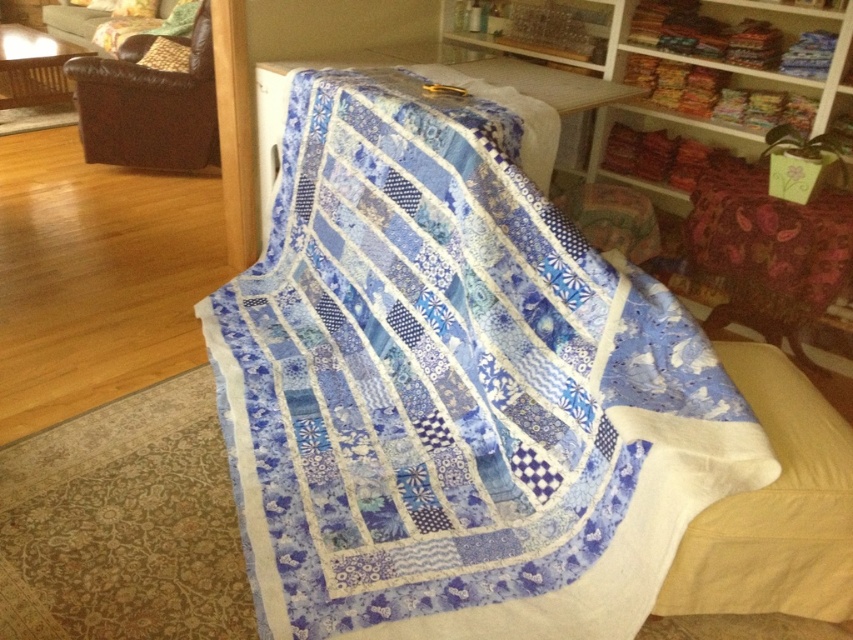
Does brown leather armchair at upper left have a lesser height compared to suede-like brown pillow at upper left?

No.

I want to click on brown leather armchair at upper left, so click(149, 104).

Is the position of brown leather armchair at upper left more distant than that of velvet green couch at upper left?

That is False.

From the picture: Does brown leather armchair at upper left have a lesser width compared to velvet green couch at upper left?

Indeed, brown leather armchair at upper left has a lesser width compared to velvet green couch at upper left.

Find the location of a particular element. The width and height of the screenshot is (853, 640). brown leather armchair at upper left is located at coordinates (149, 104).

Measure the distance from velvet floral-patterned armchair at right to velvet green couch at upper left.

3.80 meters

Does velvet floral-patterned armchair at right have a lesser width compared to velvet green couch at upper left?

Correct, velvet floral-patterned armchair at right's width is less than velvet green couch at upper left's.

I want to click on velvet floral-patterned armchair at right, so click(769, 253).